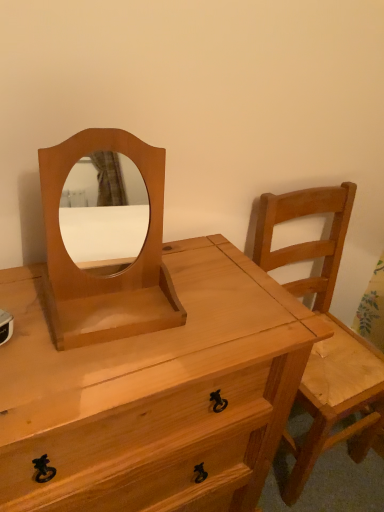
Question: Is light brown wood mirror at center thinner than natural wood chest of drawers at center?

Choices:
 (A) yes
 (B) no

Answer: (A)

Question: Is light brown wood mirror at center shorter than natural wood chest of drawers at center?

Choices:
 (A) no
 (B) yes

Answer: (B)

Question: Is light brown wood mirror at center facing towards natural wood chest of drawers at center?

Choices:
 (A) no
 (B) yes

Answer: (A)

Question: Considering the relative sizes of light brown wood mirror at center and natural wood chest of drawers at center in the image provided, is light brown wood mirror at center smaller than natural wood chest of drawers at center?

Choices:
 (A) no
 (B) yes

Answer: (B)

Question: Is light brown wood mirror at center taller than natural wood chest of drawers at center?

Choices:
 (A) yes
 (B) no

Answer: (B)

Question: Is point (259, 202) closer or farther from the camera than point (152, 247)?

Choices:
 (A) farther
 (B) closer

Answer: (A)

Question: In terms of width, does light brown wooden chair at right look wider or thinner when compared to light brown wood mirror at center?

Choices:
 (A) thin
 (B) wide

Answer: (B)

Question: Considering their positions, is light brown wooden chair at right located in front of or behind light brown wood mirror at center?

Choices:
 (A) behind
 (B) front

Answer: (A)

Question: From the image's perspective, is light brown wooden chair at right above or below light brown wood mirror at center?

Choices:
 (A) above
 (B) below

Answer: (B)

Question: Is point (142, 335) positioned closer to the camera than point (64, 289)?

Choices:
 (A) closer
 (B) farther

Answer: (A)

Question: From a real-world perspective, relative to light brown wood mirror at center, is natural wood chest of drawers at center vertically above or below?

Choices:
 (A) above
 (B) below

Answer: (B)

Question: Considering their positions, is natural wood chest of drawers at center located in front of or behind light brown wood mirror at center?

Choices:
 (A) behind
 (B) front

Answer: (B)

Question: Considering the positions of natural wood chest of drawers at center and light brown wood mirror at center in the image, is natural wood chest of drawers at center bigger or smaller than light brown wood mirror at center?

Choices:
 (A) small
 (B) big

Answer: (B)

Question: Considering the positions of point (46, 231) and point (183, 368), is point (46, 231) closer or farther from the camera than point (183, 368)?

Choices:
 (A) closer
 (B) farther

Answer: (B)

Question: Considering their positions, is light brown wood mirror at center located in front of or behind natural wood chest of drawers at center?

Choices:
 (A) front
 (B) behind

Answer: (B)